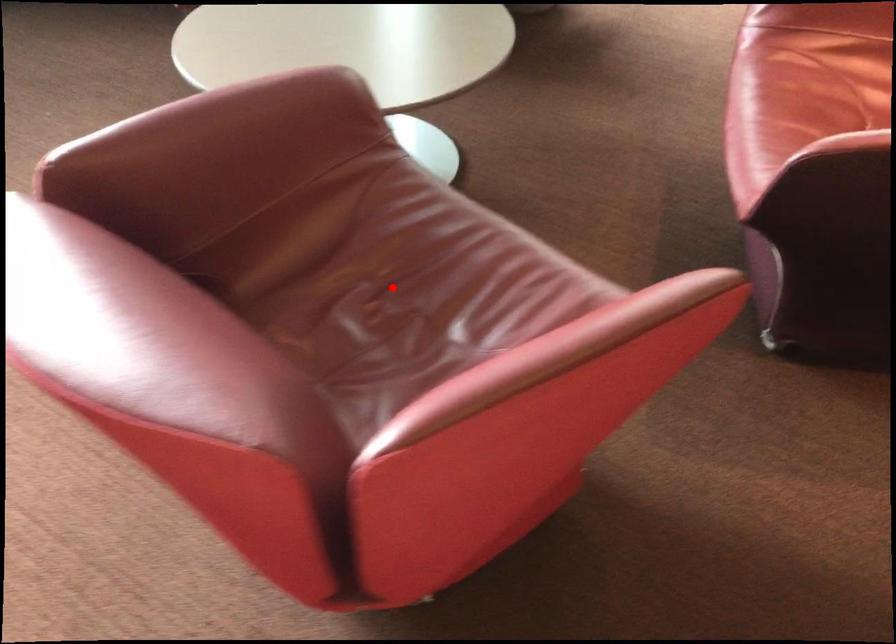
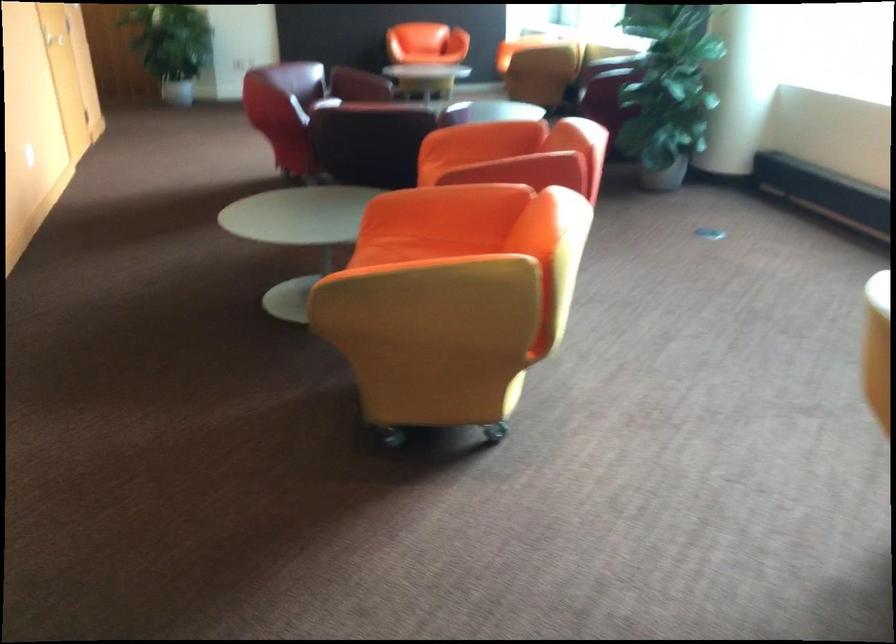
Question: I am providing you with two images of the same scene from different viewpoints. A red point is marked on the first image. At the location where the point appears in image 1, is it still visible in image 2?

Choices:
 (A) Yes
 (B) No

Answer: (B)